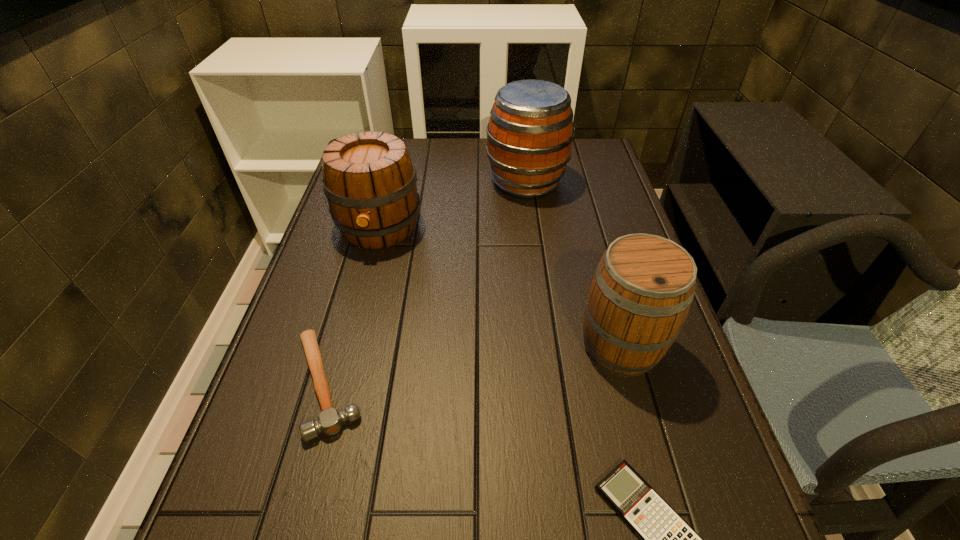
Where is `vacant space at the far edge of the desktop`? The height and width of the screenshot is (540, 960). vacant space at the far edge of the desktop is located at coordinates (441, 156).

Find the location of `vacant space at the left edge of the desktop`. vacant space at the left edge of the desktop is located at coordinates (356, 253).

In the image, there is a desktop. At what (x,y) coordinates should I click in order to perform the action: click on vacant space at the right edge. Please return your answer as a coordinate pair (x, y). This screenshot has width=960, height=540. Looking at the image, I should click on (672, 446).

The width and height of the screenshot is (960, 540). In order to click on blank area at the far right corner in this screenshot , I will do `click(600, 146)`.

The image size is (960, 540). What are the coordinates of `free point between the nearest cider and the leftmost cider` in the screenshot? It's located at tap(500, 286).

Identify the location of free space between the nearest cider and the leftmost cider. This screenshot has width=960, height=540. (500, 286).

The image size is (960, 540). I want to click on object that is the third closest to the shortest object, so click(x=370, y=184).

Choose which object is the second nearest neighbor to the hammer. Please provide its 2D coordinates. Your answer should be formatted as a tuple, i.e. [(x, y)], where the tuple contains the x and y coordinates of a point satisfying the conditions above.

[(665, 539)]

At what (x,y) coordinates should I click in order to perform the action: click on cider that is the second closest to the leftmost cider. Please return your answer as a coordinate pair (x, y). Looking at the image, I should click on pyautogui.click(x=642, y=290).

You are a GUI agent. You are given a task and a screenshot of the screen. Output one action in this format:
    pyautogui.click(x=<x>, y=<y>)
    Task: Click on the cider that is the second closest one to the leftmost cider
    
    Given the screenshot: What is the action you would take?
    pyautogui.click(x=642, y=290)